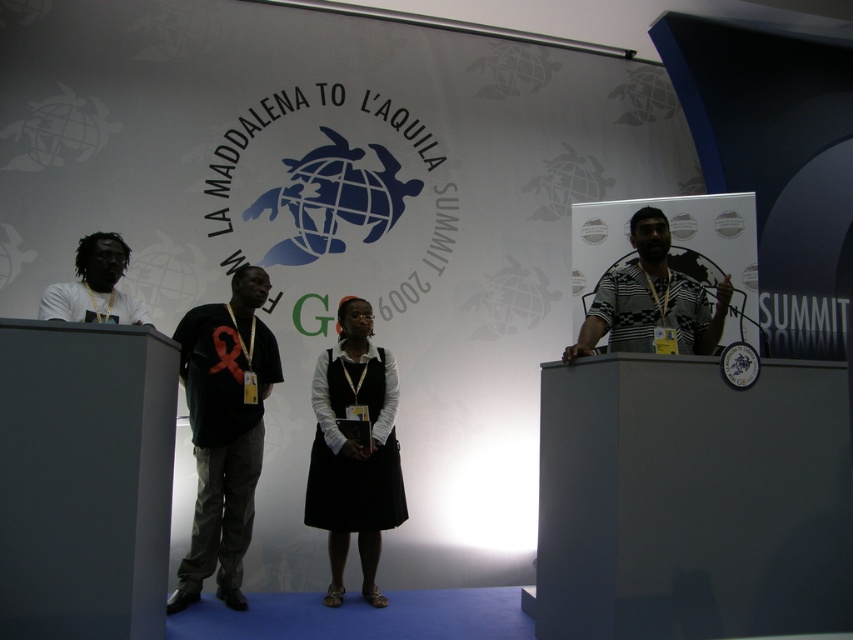
You are attending the LA MADDALENA TO L AQUILA SUMMIT 2009 and need to approach the podium. From your vantage point, which of the two people, the black matte dress at center or the striped fabric shirt at right, is closer to you?

The striped fabric shirt at right is behind the black matte dress at center, so the black matte dress at center is closer to you.